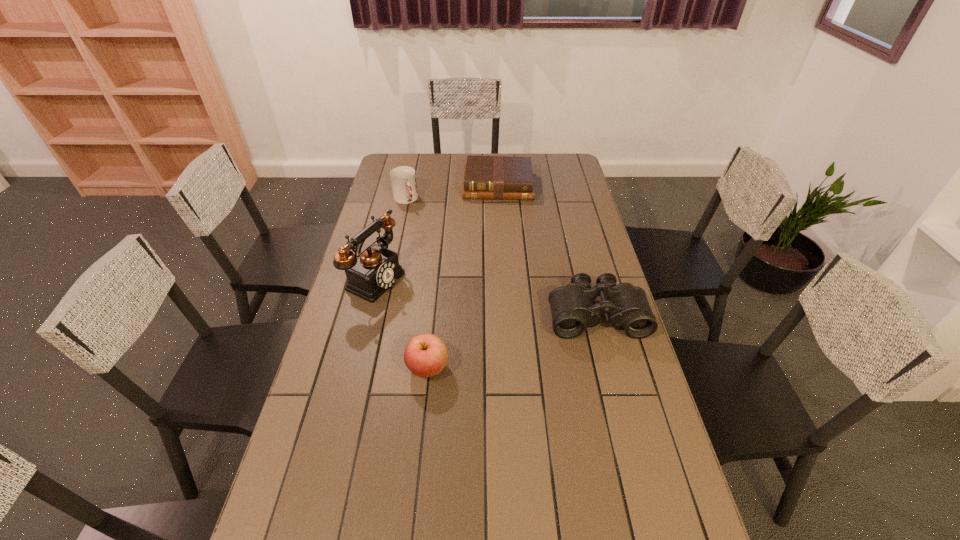
Locate an element on the screen. object present at the right edge is located at coordinates (573, 308).

The image size is (960, 540). What are the coordinates of `blank area at the left edge` in the screenshot? It's located at (339, 469).

In the image, there is a desktop. Identify the location of vacant space at the right edge. (561, 187).

Find the location of a particular element. vacant space at the far left corner of the desktop is located at coordinates [392, 160].

The height and width of the screenshot is (540, 960). Identify the location of vacant space in between the tallest object and the apple. (402, 322).

Locate an element on the screen. This screenshot has height=540, width=960. vacant space that is in between the telephone and the nearest object is located at coordinates (402, 322).

This screenshot has height=540, width=960. I want to click on vacant region between the binoculars and the nearest object, so click(x=512, y=341).

Locate an element on the screen. vacant space in between the telephone and the nearest object is located at coordinates (402, 322).

Where is `free spot between the Bible and the nearest object`? free spot between the Bible and the nearest object is located at coordinates (463, 276).

At what (x,y) coordinates should I click in order to perform the action: click on free spot between the cup and the binoculars. Please return your answer as a coordinate pair (x, y). Looking at the image, I should click on (501, 257).